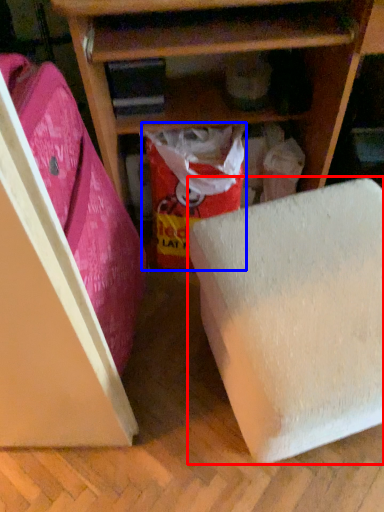
Question: Which object appears farthest to the camera in this image, furniture (highlighted by a red box) or wrapping paper (highlighted by a blue box)?

Choices:
 (A) furniture
 (B) wrapping paper

Answer: (B)